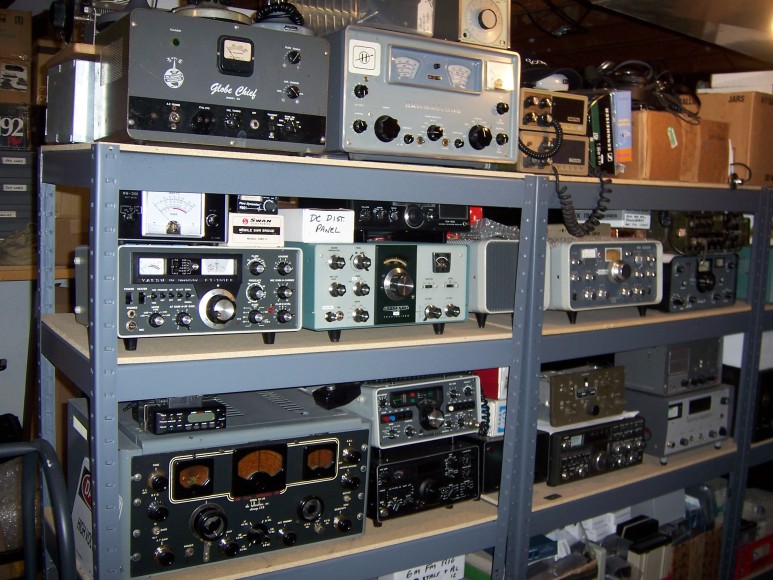
This screenshot has width=773, height=580. Find the location of `shelf`. shelf is located at coordinates (342, 172), (649, 198), (369, 348), (618, 334), (410, 532), (618, 482).